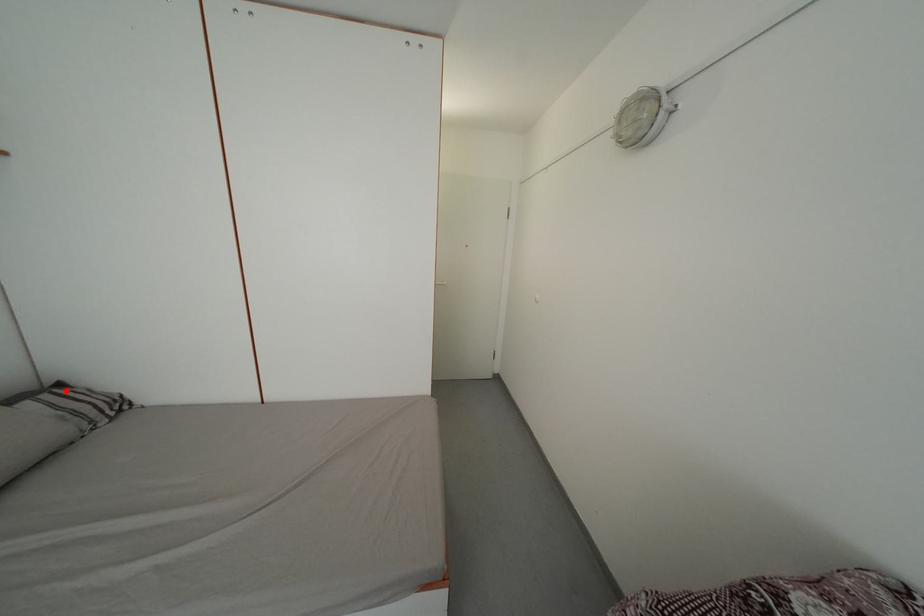
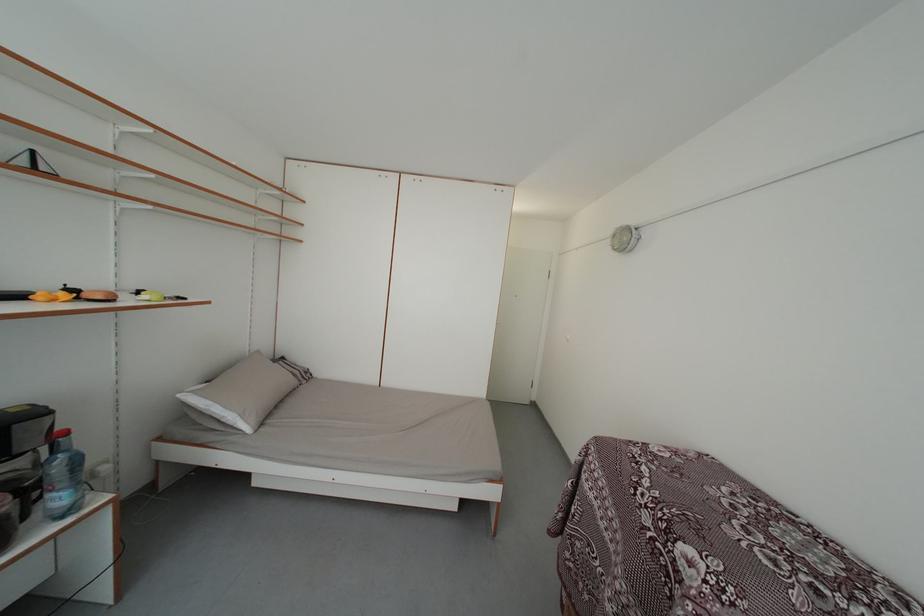
In the second image, find the point that corresponds to the highlighted location in the first image.

(289, 365)